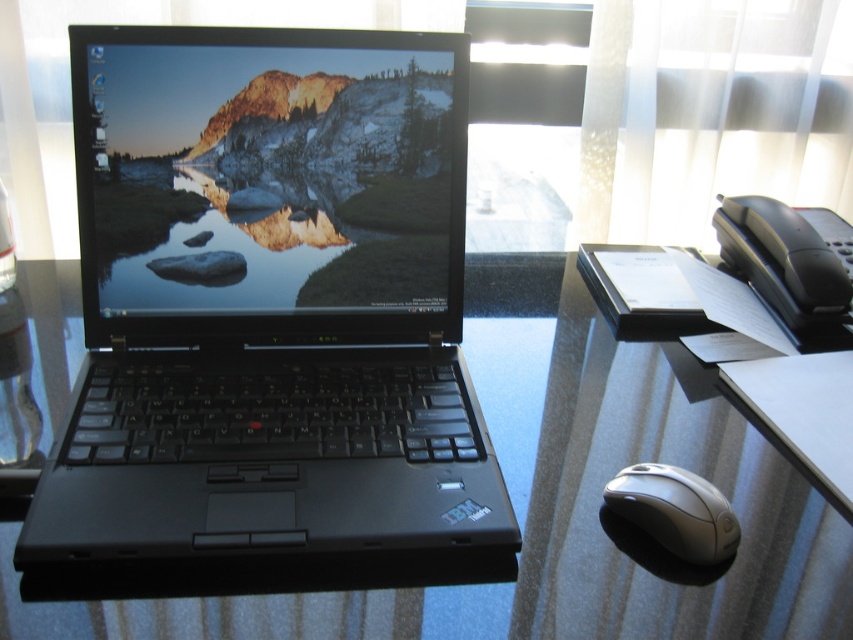
Which of these two, black plastic laptop at center or black plastic phone at upper right, stands taller?

black plastic laptop at center is taller.

Which is more to the left, black plastic laptop at center or black plastic phone at upper right?

black plastic laptop at center is more to the left.

From the picture: Measure the distance between black plastic laptop at center and camera.

They are 19.35 inches apart.

Where is `black plastic laptop at center`? The image size is (853, 640). black plastic laptop at center is located at coordinates (268, 300).

Is black plastic laptop at center smaller than glossy glass table at center?

Indeed, black plastic laptop at center has a smaller size compared to glossy glass table at center.

You are a GUI agent. You are given a task and a screenshot of the screen. Output one action in this format:
    pyautogui.click(x=<x>, y=<y>)
    Task: Click on the black plastic laptop at center
    The image size is (853, 640).
    Given the screenshot: What is the action you would take?
    pyautogui.click(x=268, y=300)

In the scene shown: Does glossy glass table at center come in front of white glossy mouse at lower right?

Yes, glossy glass table at center is closer to the viewer.

Who is positioned more to the left, glossy glass table at center or white glossy mouse at lower right?

From the viewer's perspective, glossy glass table at center appears more on the left side.

Describe the element at coordinates (520, 515) in the screenshot. The height and width of the screenshot is (640, 853). I see `glossy glass table at center` at that location.

Locate an element on the screen. glossy glass table at center is located at coordinates (520, 515).